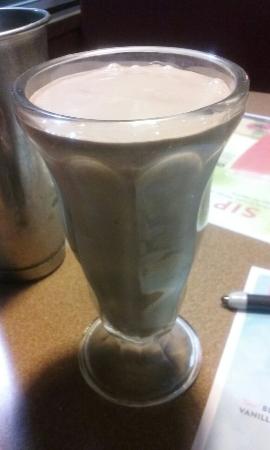
Find the location of `1 pen`. 1 pen is located at coordinates (250, 302).